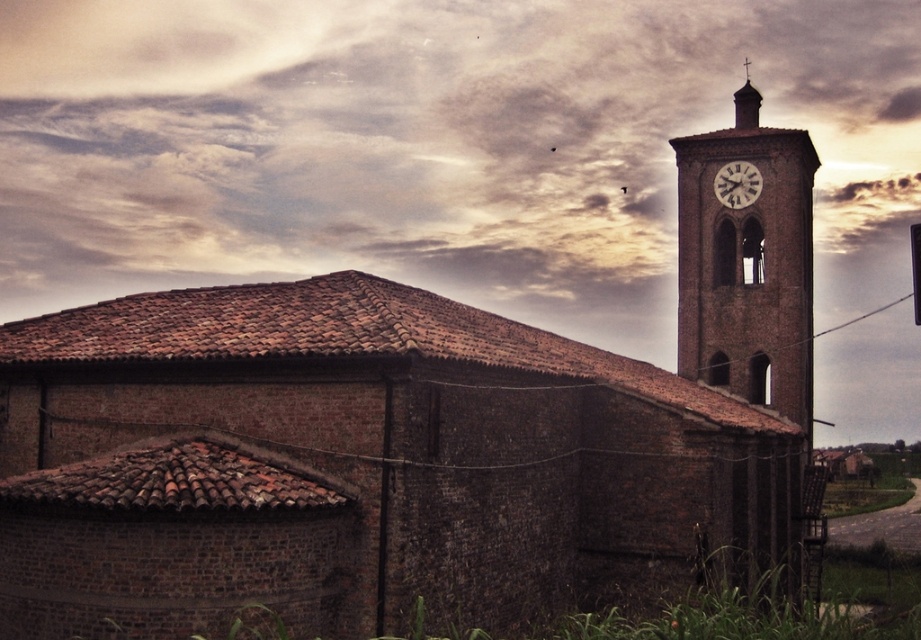
Question: Which of the following is the farthest from the observer?

Choices:
 (A) brown brick clock tower at upper right
 (B) white metallic clock at upper right

Answer: (B)

Question: Which of the following is the closest to the observer?

Choices:
 (A) (733, 166)
 (B) (754, 118)
 (C) (653, 145)

Answer: (A)

Question: Observing the image, what is the correct spatial positioning of cloudy sky at upper center in reference to smooth stone clock tower at upper right?

Choices:
 (A) above
 (B) below

Answer: (B)

Question: Estimate the real-world distances between objects in this image. Which object is farther from the smooth stone clock tower at upper right?

Choices:
 (A) white metallic clock at upper right
 (B) cloudy sky at upper center
 (C) brown brick clock tower at upper right

Answer: (B)

Question: Is the position of cloudy sky at upper center less distant than that of smooth stone clock tower at upper right?

Choices:
 (A) no
 (B) yes

Answer: (B)

Question: Can you confirm if cloudy sky at upper center is positioned to the right of smooth stone clock tower at upper right?

Choices:
 (A) yes
 (B) no

Answer: (B)